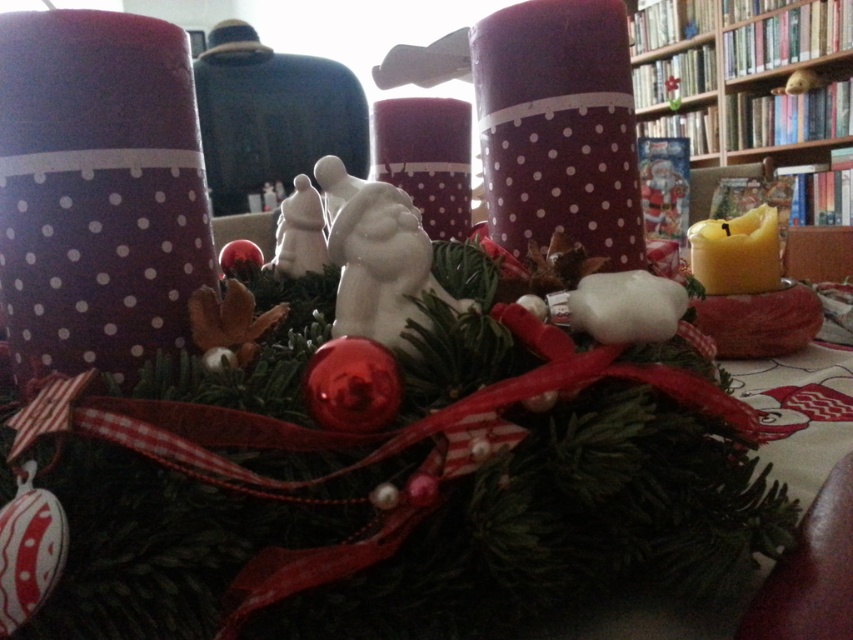
Does point (173, 492) come farther from viewer compared to point (820, 113)?

No, it is not.

Is green matte wreath at center positioned at the back of wooden bookshelf at upper right?

No, it is in front of wooden bookshelf at upper right.

Who is more forward, (178, 625) or (809, 36)?

Point (178, 625)

The image size is (853, 640). Find the location of `green matte wreath at center`. green matte wreath at center is located at coordinates (380, 454).

What do you see at coordinates (380, 454) in the screenshot? I see `green matte wreath at center` at bounding box center [380, 454].

Between green matte wreath at center and matte polka dot candle at center, which one appears on the right side from the viewer's perspective?

matte polka dot candle at center

Identify the location of green matte wreath at center. This screenshot has height=640, width=853. (380, 454).

Does point (642, 80) come farther from viewer compared to point (410, 140)?

Yes, it is.

Is wooden bookshelf at upper right behind matte polka dot candle at center?

Yes.

In order to click on wooden bookshelf at upper right in this screenshot , I will do `click(753, 83)`.